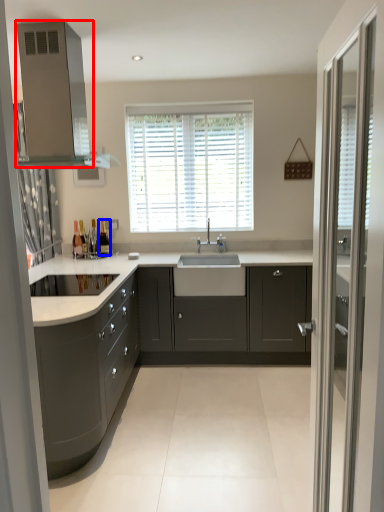
Question: Which object is further to the camera taking this photo, vent (highlighted by a red box) or bottle (highlighted by a blue box)?

Choices:
 (A) vent
 (B) bottle

Answer: (B)